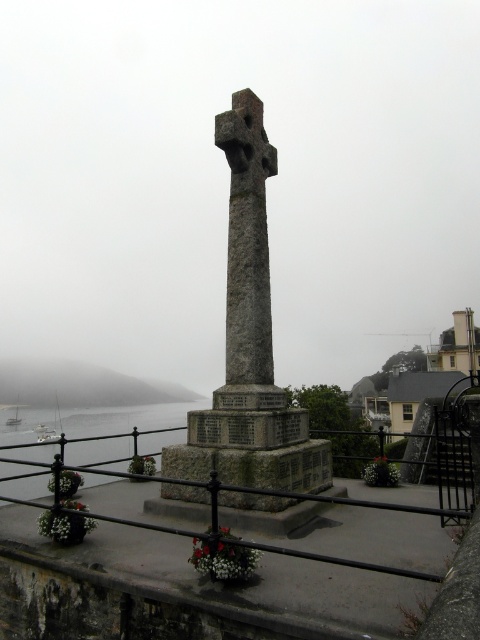
You are a visitor at the monument and want to take a photo of the gray stone cross at center and the foggy gray hillside at lower left. Which object should you focus on first if you want to capture both in the same frame?

The gray stone cross at center is positioned on the right side of foggy gray hillside at lower left, so you should focus on the foggy gray hillside at lower left first to ensure both are in the frame.

You are standing near the stone cross monument and want to take a photo of the clear water at lower left and the foggy gray hillside at lower left. Which object is positioned higher in the image?

The clear water at lower left is located above the foggy gray hillside at lower left, so it is positioned higher in the image.